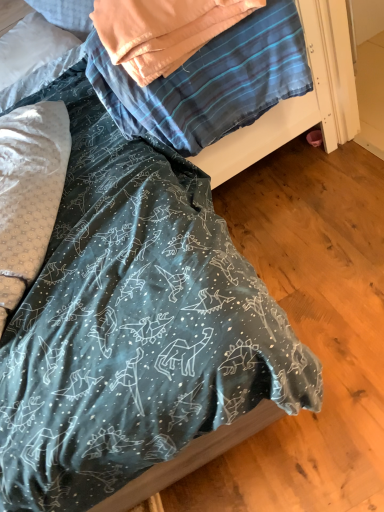
Question: Does white dotted fabric pillow at left, which appears as the 1th pillow when ordered from the bottom, have a smaller size compared to white soft pillow at upper left, the 1th pillow in the back-to-front sequence?

Choices:
 (A) yes
 (B) no

Answer: (B)

Question: Is white dotted fabric pillow at left, which appears as the second pillow when viewed from the back, further to camera compared to white soft pillow at upper left, the 1th pillow in the back-to-front sequence?

Choices:
 (A) no
 (B) yes

Answer: (A)

Question: Can you see white dotted fabric pillow at left, arranged as the 1th pillow when viewed from the front, touching white soft pillow at upper left, the second pillow when ordered from front to back?

Choices:
 (A) yes
 (B) no

Answer: (B)

Question: Can you confirm if white dotted fabric pillow at left, which appears as the 1th pillow when ordered from the bottom, is positioned to the right of white soft pillow at upper left, the 1th pillow in the back-to-front sequence?

Choices:
 (A) yes
 (B) no

Answer: (A)

Question: From a real-world perspective, is white dotted fabric pillow at left, arranged as the 1th pillow when viewed from the front, on top of white soft pillow at upper left, the 1th pillow in the back-to-front sequence?

Choices:
 (A) yes
 (B) no

Answer: (B)

Question: Is white soft pillow at upper left, acting as the 1th pillow starting from the top, wider or thinner than white dotted fabric pillow at left, arranged as the 1th pillow when viewed from the front?

Choices:
 (A) thin
 (B) wide

Answer: (A)

Question: Looking at the image, does white soft pillow at upper left, which is the 2th pillow in bottom-to-top order, seem bigger or smaller compared to white dotted fabric pillow at left, arranged as the 1th pillow when viewed from the front?

Choices:
 (A) big
 (B) small

Answer: (B)

Question: From the image's perspective, is white soft pillow at upper left, the second pillow when ordered from front to back, located above or below white dotted fabric pillow at left, the second pillow when ordered from top to bottom?

Choices:
 (A) above
 (B) below

Answer: (A)

Question: In the image, is white soft pillow at upper left, acting as the 1th pillow starting from the top, positioned in front of or behind white dotted fabric pillow at left, which appears as the 1th pillow when ordered from the bottom?

Choices:
 (A) behind
 (B) front

Answer: (A)

Question: Is white dotted fabric pillow at left, which appears as the second pillow when viewed from the back, to the left or to the right of white soft pillow at upper left, the second pillow when ordered from front to back, in the image?

Choices:
 (A) left
 (B) right

Answer: (B)

Question: From the image's perspective, is white dotted fabric pillow at left, which appears as the 1th pillow when ordered from the bottom, positioned above or below white soft pillow at upper left, which is the 2th pillow in bottom-to-top order?

Choices:
 (A) below
 (B) above

Answer: (A)

Question: Is point (18, 119) positioned closer to the camera than point (26, 46)?

Choices:
 (A) closer
 (B) farther

Answer: (A)

Question: Based on their sizes in the image, would you say white dotted fabric pillow at left, the second pillow when ordered from top to bottom, is bigger or smaller than white soft pillow at upper left, which is the 2th pillow in bottom-to-top order?

Choices:
 (A) small
 (B) big

Answer: (B)

Question: From the image's perspective, is teal fabric at center positioned above or below white soft pillow at upper left, the second pillow when ordered from front to back?

Choices:
 (A) above
 (B) below

Answer: (B)

Question: Considering the relative positions of teal fabric at center and white soft pillow at upper left, the second pillow when ordered from front to back, in the image provided, is teal fabric at center to the left or to the right of white soft pillow at upper left, the second pillow when ordered from front to back,?

Choices:
 (A) left
 (B) right

Answer: (B)